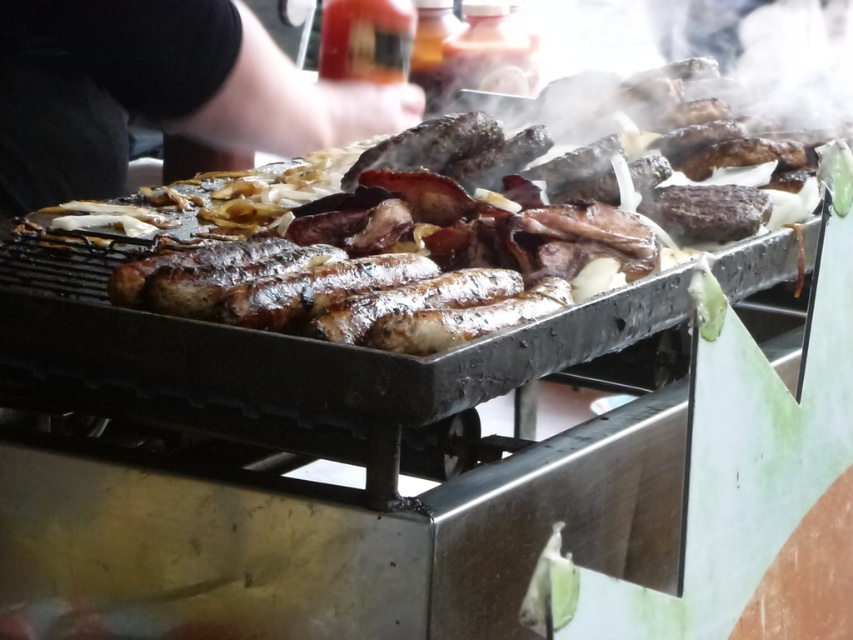
Question: Does shiny brown meat at center appear on the left side of black fabric arm at upper left?

Choices:
 (A) yes
 (B) no

Answer: (B)

Question: Is shiny brown meat at center to the left of black fabric arm at upper left from the viewer's perspective?

Choices:
 (A) no
 (B) yes

Answer: (A)

Question: Which point is closer to the camera?

Choices:
 (A) black fabric arm at upper left
 (B) shiny brown meat at center

Answer: (B)

Question: Which object is farther from the camera taking this photo?

Choices:
 (A) black fabric arm at upper left
 (B) shiny brown meat at center

Answer: (A)

Question: From the image, what is the correct spatial relationship of shiny brown meat at center in relation to black fabric arm at upper left?

Choices:
 (A) below
 (B) above

Answer: (A)